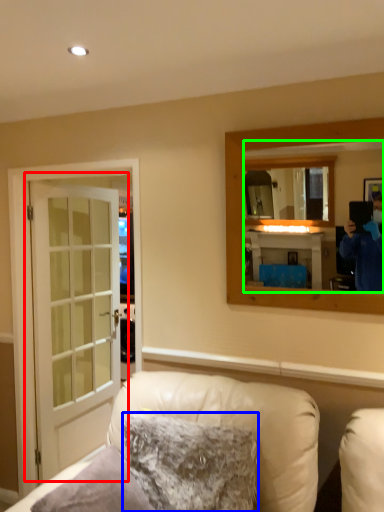
Question: Estimate the real-world distances between objects in this image. Which object is closer to door (highlighted by a red box), pillow (highlighted by a blue box) or mirror (highlighted by a green box)?

Choices:
 (A) pillow
 (B) mirror

Answer: (A)